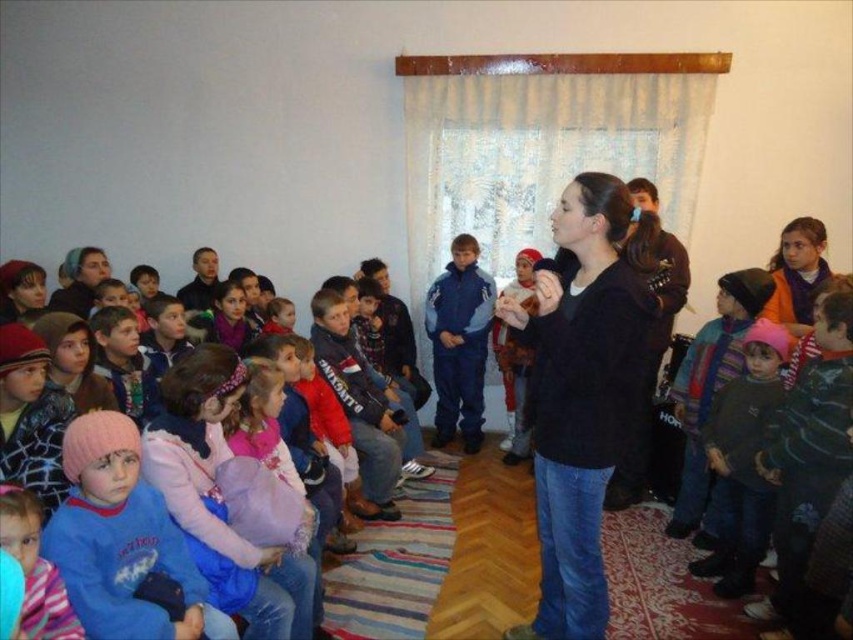
Describe the element at coordinates (306, 435) in the screenshot. The height and width of the screenshot is (640, 853). I see `pink woolen hats at left` at that location.

Which is behind, point (265, 513) or point (57, 513)?

Point (265, 513)

This screenshot has width=853, height=640. Find the location of `pink woolen hats at left`. pink woolen hats at left is located at coordinates (306, 435).

Can you confirm if pink fleece jacket at lower left is positioned above blue fleece jacket at center?

No, pink fleece jacket at lower left is not above blue fleece jacket at center.

Does point (67, 522) come in front of point (462, 273)?

Yes, it is.

Does point (73, 596) come behind point (448, 403)?

No.

The image size is (853, 640). Identify the location of pink fleece jacket at lower left. (120, 540).

Does black matte shirt at center have a lesser width compared to pink fleece jacket at lower left?

No.

Can you confirm if black matte shirt at center is positioned below pink fleece jacket at lower left?

No.

Between point (589, 273) and point (65, 538), which one is positioned behind?

The point (589, 273) is more distant.

I want to click on black matte shirt at center, so click(583, 390).